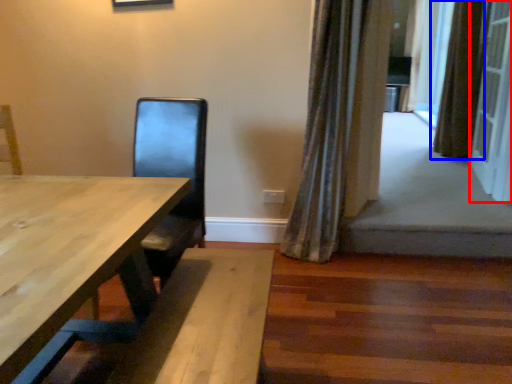
Question: Which object appears farthest to the camera in this image, screen door (highlighted by a red box) or curtain (highlighted by a blue box)?

Choices:
 (A) screen door
 (B) curtain

Answer: (B)